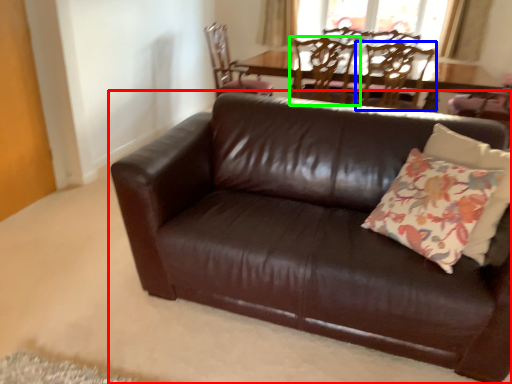
Question: Which object is the closest to the studio couch (highlighted by a red box)? Choose among these: chair (highlighted by a blue box) or chair (highlighted by a green box).

Choices:
 (A) chair
 (B) chair

Answer: (B)